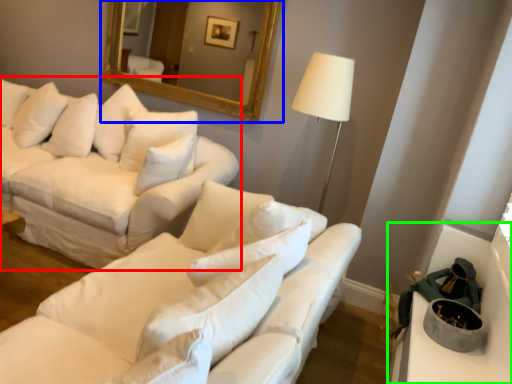
Question: Which object is the closest to the studio couch (highlighted by a red box)? Choose among these: mirror (highlighted by a blue box) or table (highlighted by a green box).

Choices:
 (A) mirror
 (B) table

Answer: (A)